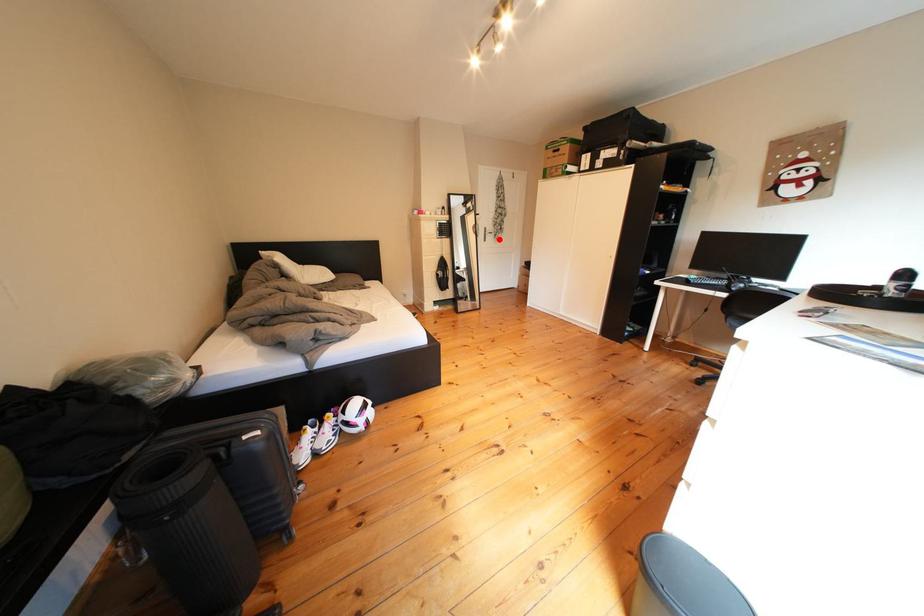
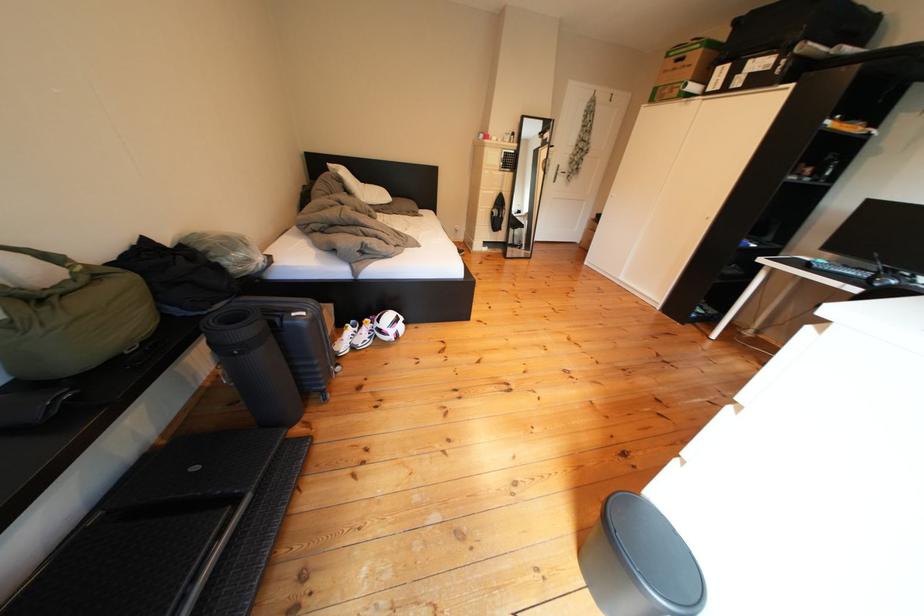
In the second image, find the point that corresponds to the highlighted location in the first image.

(570, 179)